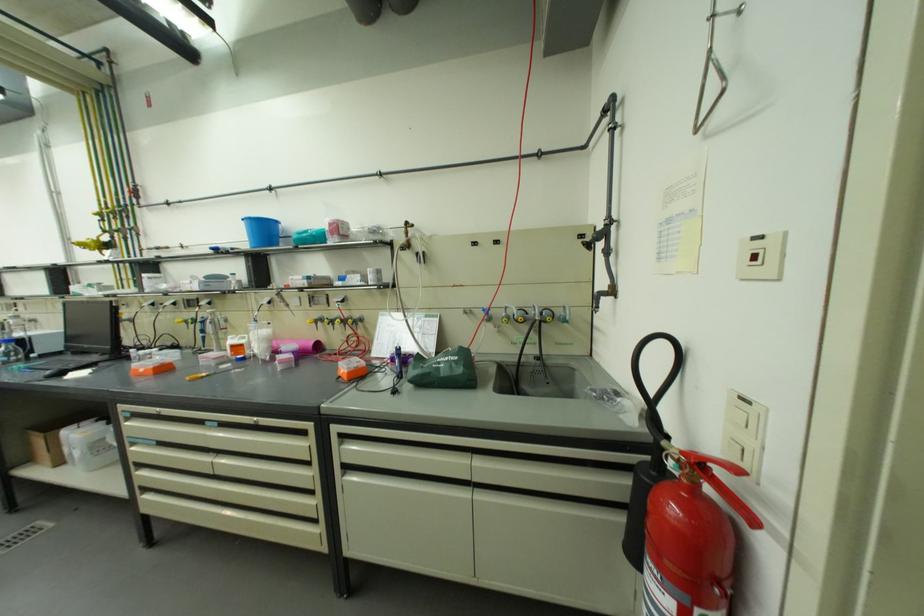
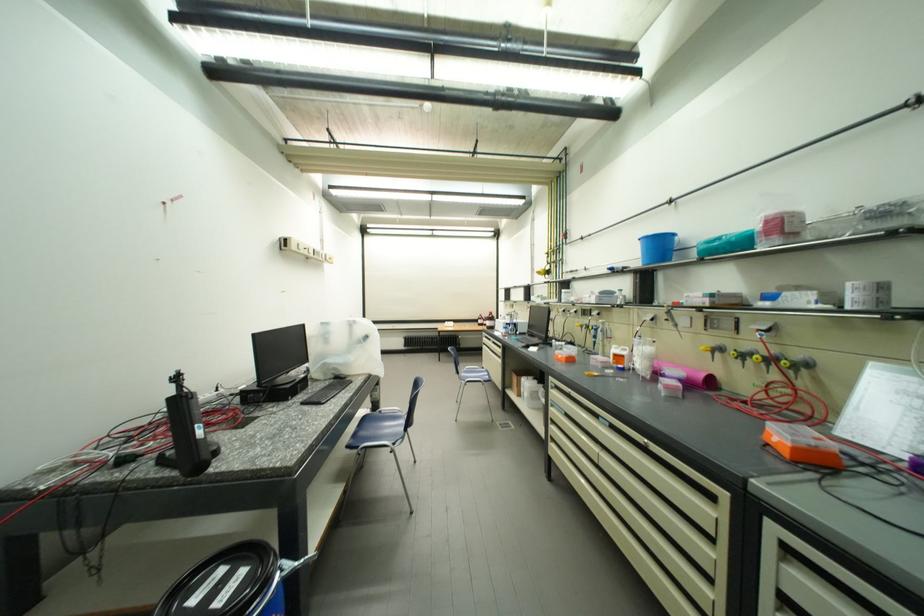
The point at (251,222) is marked in the first image. Where is the corresponding point in the second image?

(649, 241)